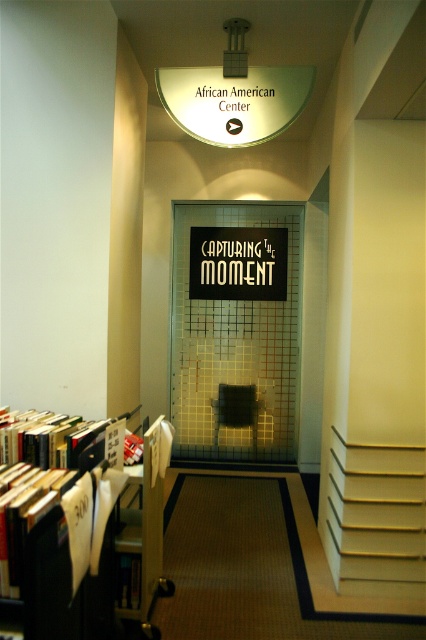
Does white paper-covered books at left have a greater height compared to white/yellow stair at right?

Correct, white paper-covered books at left is much taller as white/yellow stair at right.

Who is shorter, white paper-covered books at left or white/yellow stair at right?

Standing shorter between the two is white/yellow stair at right.

Image resolution: width=426 pixels, height=640 pixels. In order to click on white paper-covered books at left in this screenshot , I will do `click(75, 529)`.

Image resolution: width=426 pixels, height=640 pixels. What do you see at coordinates (374, 518) in the screenshot? I see `white/yellow stair at right` at bounding box center [374, 518].

Does white/yellow stair at right have a greater width compared to matte glass sign at upper center?

No, white/yellow stair at right is not wider than matte glass sign at upper center.

Is point (386, 492) less distant than point (264, 128)?

Yes, point (386, 492) is closer to viewer.

This screenshot has height=640, width=426. Identify the location of white/yellow stair at right. (374, 518).

Does white paper-covered books at left have a greater height compared to matte glass sign at upper center?

Yes.

Does white paper-covered books at left have a smaller size compared to matte glass sign at upper center?

Incorrect, white paper-covered books at left is not smaller in size than matte glass sign at upper center.

Does point (52, 564) lie in front of point (204, 102)?

Yes, it is in front of point (204, 102).

The height and width of the screenshot is (640, 426). I want to click on white paper-covered books at left, so click(x=75, y=529).